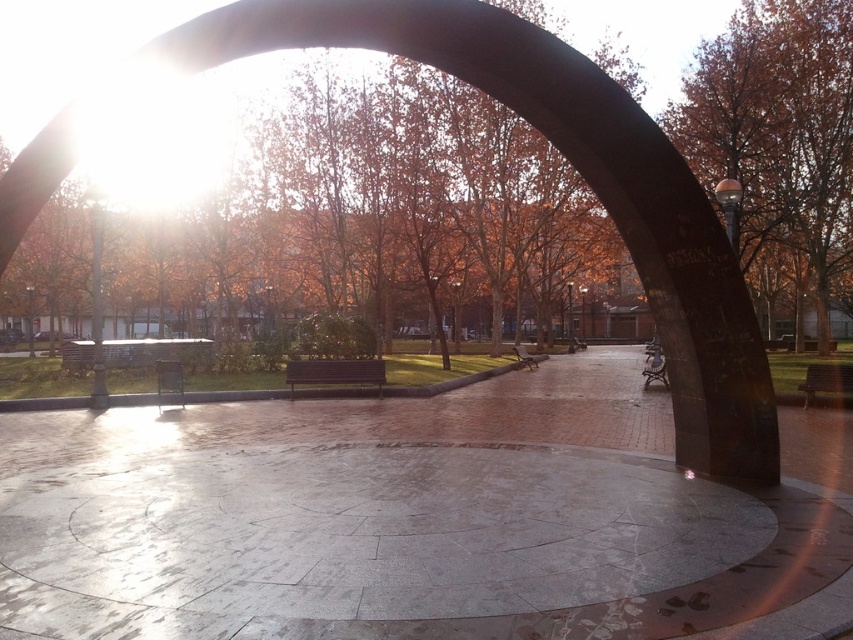
Question: Which of the following is the farthest from the observer?

Choices:
 (A) (846, 172)
 (B) (303, 19)

Answer: (A)

Question: Does polished bronze arch at center lie in front of brown wood tree at right?

Choices:
 (A) no
 (B) yes

Answer: (B)

Question: Which point is closer to the camera?

Choices:
 (A) (810, 22)
 (B) (386, 16)

Answer: (B)

Question: Is polished bronze arch at center wider than brown wood tree at right?

Choices:
 (A) yes
 (B) no

Answer: (B)

Question: Is polished bronze arch at center to the right of brown wood tree at right from the viewer's perspective?

Choices:
 (A) yes
 (B) no

Answer: (B)